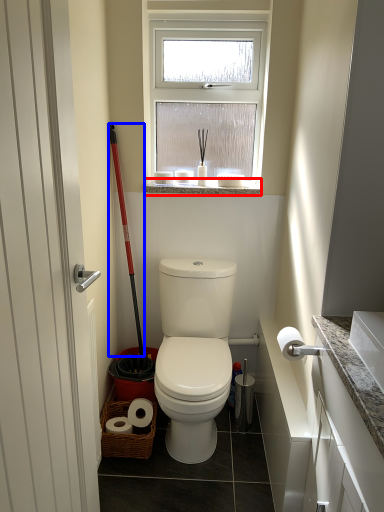
Question: Which point is closer to the camera, window sill (highlighted by a red box) or ski pole (highlighted by a blue box)?

Choices:
 (A) window sill
 (B) ski pole

Answer: (B)